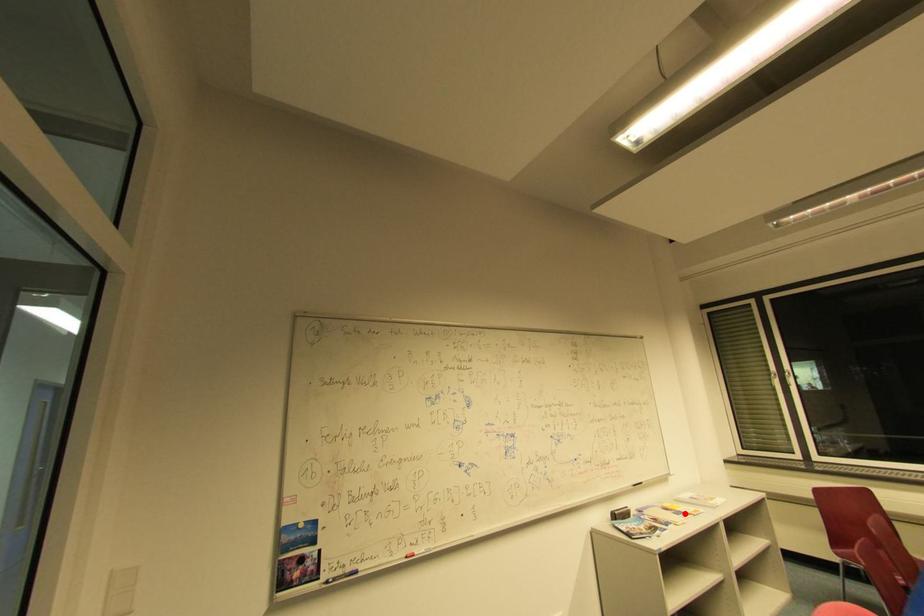
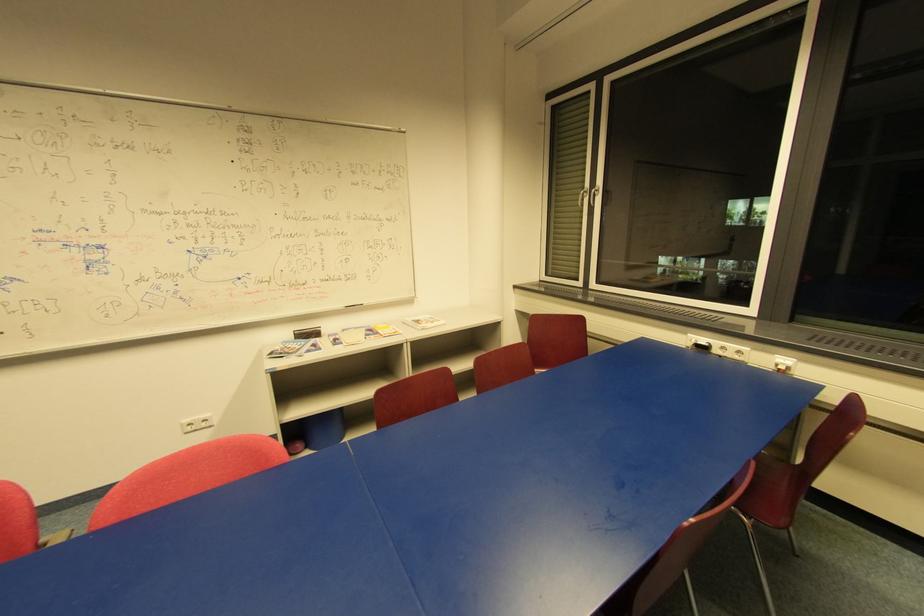
The point at the highlighted location is marked in the first image. Where is the corresponding point in the second image?

(381, 334)